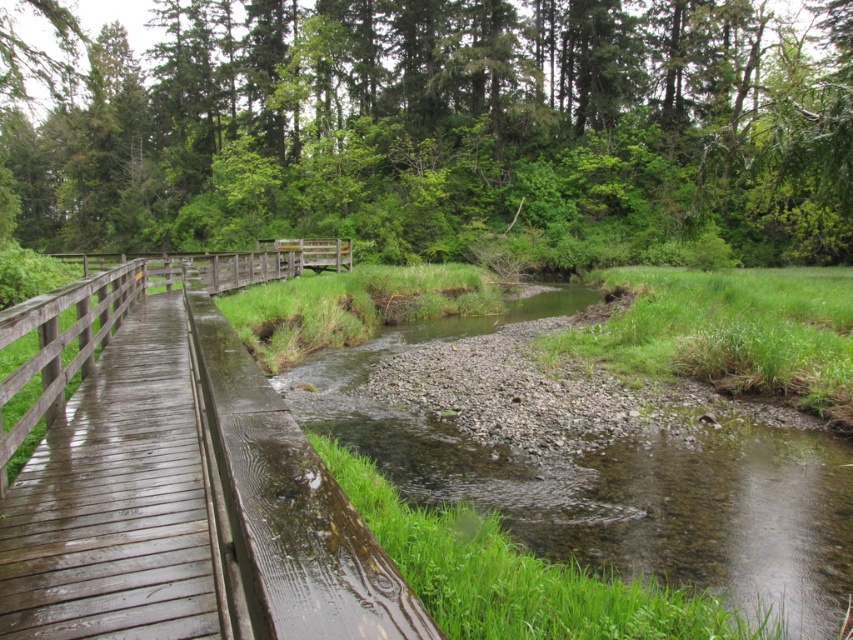
Does green leafy forest at upper center have a smaller size compared to rustic wooden bridge at left?

Actually, green leafy forest at upper center might be larger than rustic wooden bridge at left.

Does green leafy forest at upper center appear under rustic wooden bridge at left?

No.

The width and height of the screenshot is (853, 640). What do you see at coordinates (445, 131) in the screenshot?
I see `green leafy forest at upper center` at bounding box center [445, 131].

Image resolution: width=853 pixels, height=640 pixels. What are the coordinates of `green leafy forest at upper center` in the screenshot? It's located at click(x=445, y=131).

Is rustic wooden bridge at left below wooden bridge at center?

Correct, rustic wooden bridge at left is located below wooden bridge at center.

Can you confirm if rustic wooden bridge at left is wider than wooden bridge at center?

Incorrect, rustic wooden bridge at left's width does not surpass wooden bridge at center's.

Who is more distant from viewer, [22,593] or [115,256]?

Point [115,256]

You are a GUI agent. You are given a task and a screenshot of the screen. Output one action in this format:
    pyautogui.click(x=<x>, y=<y>)
    Task: Click on the rustic wooden bridge at left
    
    Given the screenshot: What is the action you would take?
    (x=186, y=474)

Is point (347, 369) farther from camera compared to point (138, 253)?

No.

You are a GUI agent. You are given a task and a screenshot of the screen. Output one action in this format:
    pyautogui.click(x=<x>, y=<y>)
    Task: Click on the smooth gravel bed at center
    This screenshot has height=640, width=853.
    Given the screenshot: What is the action you would take?
    pyautogui.click(x=616, y=483)

Is point (590, 536) behind point (74, 257)?

That is False.

At what (x,y) coordinates should I click in order to perform the action: click on smooth gravel bed at center. Please return your answer as a coordinate pair (x, y). Looking at the image, I should click on (616, 483).